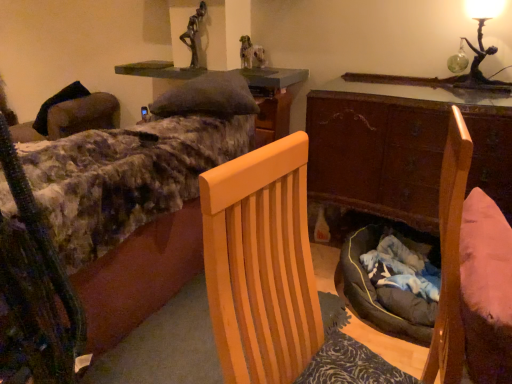
Question: Is green glass figure at upper right in front of or behind wooden desk at center in the image?

Choices:
 (A) behind
 (B) front

Answer: (A)

Question: Is point (493, 3) closer or farther from the camera than point (373, 142)?

Choices:
 (A) farther
 (B) closer

Answer: (B)

Question: Estimate the real-world distances between objects in this image. Which object is closer to the wooden desk at center?

Choices:
 (A) light wood chair at center
 (B) fluffy fabric bed at upper left
 (C) green felt cushion at upper center
 (D) green glass figure at upper right

Answer: (D)

Question: Which is farther from the wooden desk at center?

Choices:
 (A) green felt cushion at upper center
 (B) fluffy fabric bed at upper left
 (C) light wood chair at center
 (D) green glass figure at upper right

Answer: (C)